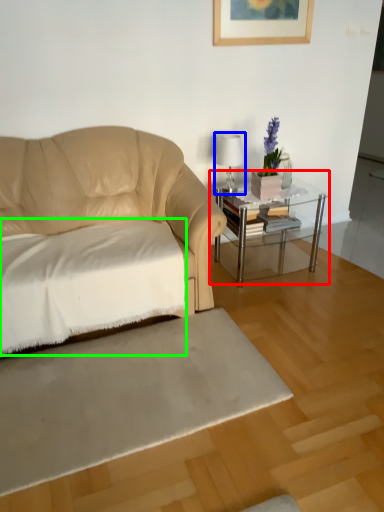
Question: Based on their relative distances, which object is farther from table (highlighted by a red box)? Choose from table lamp (highlighted by a blue box) and sheet (highlighted by a green box).

Choices:
 (A) table lamp
 (B) sheet

Answer: (B)